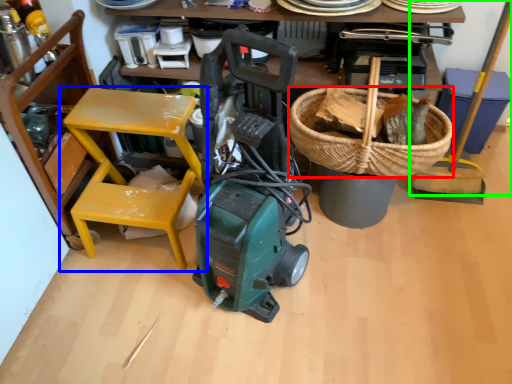
Question: Based on their relative distances, which object is farther from basket (highlighted by a red box)? Choose from chair (highlighted by a blue box) and shovel (highlighted by a green box).

Choices:
 (A) chair
 (B) shovel

Answer: (A)